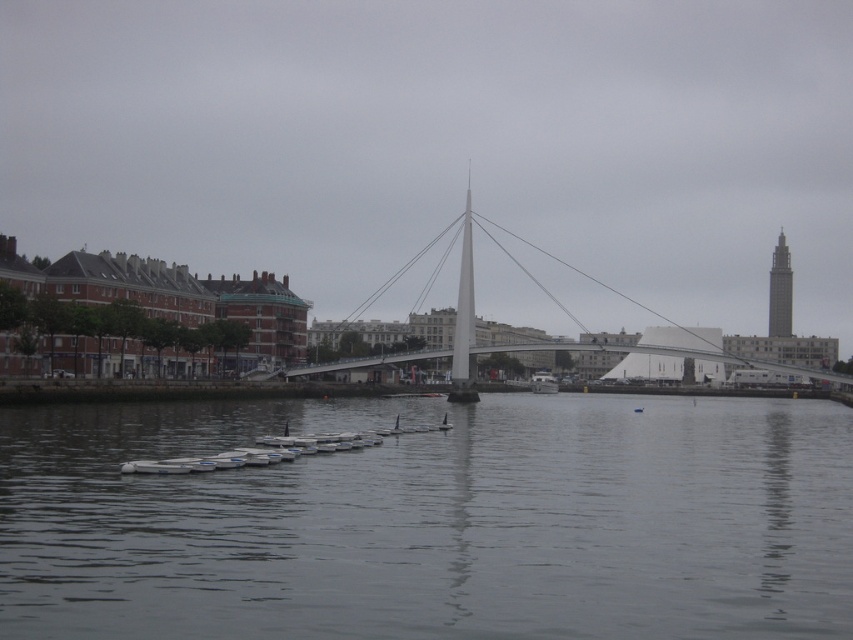
You are standing on the riverside path and see the white plastic boats at center and the white plastic boat at center. Which one is nearer to you?

The white plastic boats at center is closer to the viewer than the white plastic boat at center.